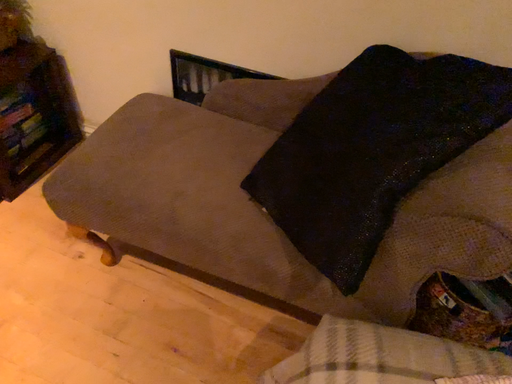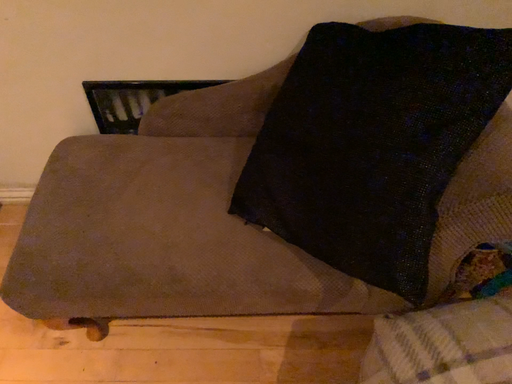
Question: Which way did the camera rotate in the video?

Choices:
 (A) rotated right
 (B) rotated left

Answer: (A)